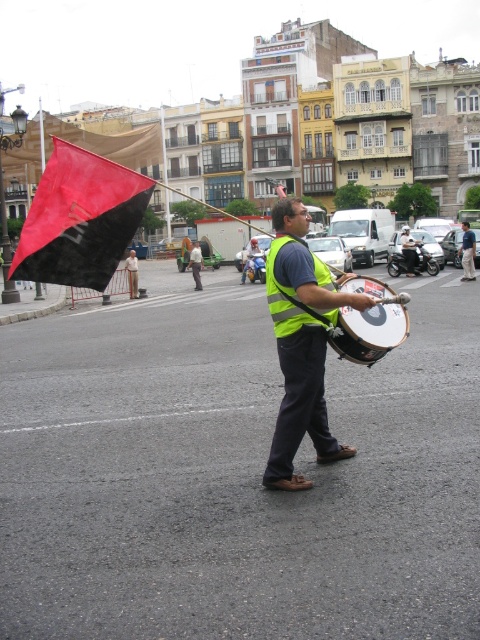
Question: Among these objects, which one is nearest to the camera?

Choices:
 (A) light green fabric shirt at center
 (B) matte black drum at center
 (C) red fabric flag at upper left
 (D) neon yellow reflective vest at center

Answer: (B)

Question: Which point is closer to the camera taking this photo?

Choices:
 (A) (267, 260)
 (B) (409, 246)

Answer: (A)

Question: Can you confirm if reflective yellow safety vest at center is bigger than reflective yellow vest at center?

Choices:
 (A) no
 (B) yes

Answer: (A)

Question: Is red fabric flag at upper left thinner than reflective yellow vest at center?

Choices:
 (A) yes
 (B) no

Answer: (B)

Question: Can you confirm if red fabric flag at upper left is smaller than matte black drum at center?

Choices:
 (A) no
 (B) yes

Answer: (A)

Question: Which is nearer to the matte black drum at center?

Choices:
 (A) red fabric flag at upper left
 (B) yellow reflective vest at center

Answer: (A)